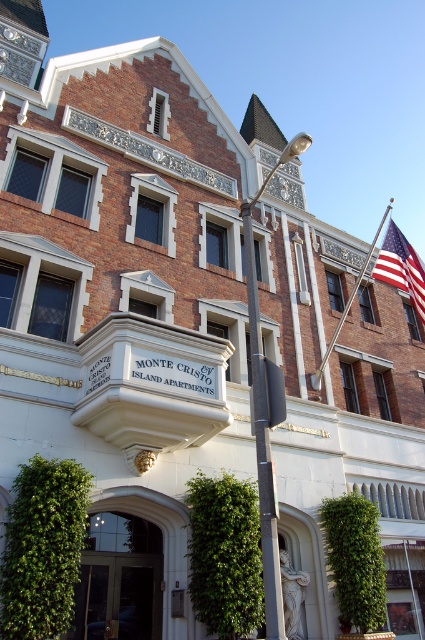
Question: Can you confirm if american flag at upper right is smaller than metallic flag pole at upper right?

Choices:
 (A) no
 (B) yes

Answer: (B)

Question: Which object is farther from the camera taking this photo?

Choices:
 (A) american flag at upper right
 (B) metallic pole at center
 (C) metallic flag pole at upper right

Answer: (A)

Question: Which point is farther to the camera?

Choices:
 (A) (252, 365)
 (B) (326, 356)

Answer: (B)

Question: Can you confirm if metallic pole at center is positioned to the right of metallic flag pole at upper right?

Choices:
 (A) yes
 (B) no

Answer: (B)

Question: Which object is closer to the camera taking this photo?

Choices:
 (A) metallic flag pole at upper right
 (B) american flag at upper right

Answer: (A)

Question: Does metallic pole at center have a smaller size compared to american flag at upper right?

Choices:
 (A) no
 (B) yes

Answer: (B)